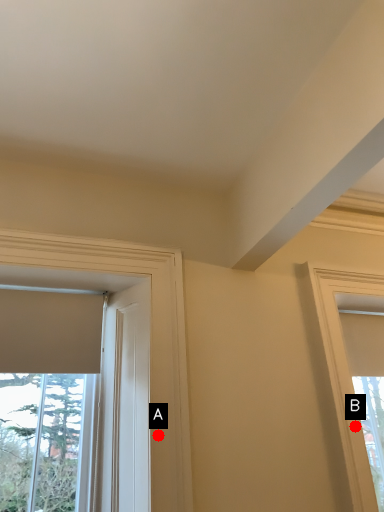
Question: Two points are circled on the image, labeled by A and B beside each circle. Which of the following is the closest to the observer?

Choices:
 (A) A is closer
 (B) B is closer

Answer: (A)